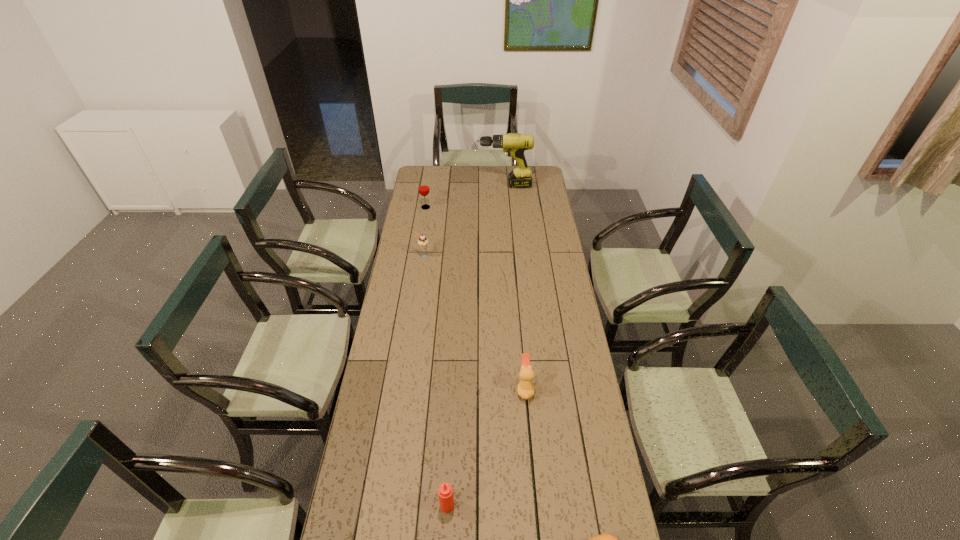
Locate an element on the screen. free space that is in between the glass and the duck is located at coordinates (475, 298).

Locate an element on the screen. vacant region between the drill and the glass is located at coordinates (465, 197).

Identify the location of free space that is in between the Tabasco sauce and the fifth tallest object. (486, 447).

Locate an element on the screen. Image resolution: width=960 pixels, height=540 pixels. empty space that is in between the icecream and the Tabasco sauce is located at coordinates (435, 381).

The height and width of the screenshot is (540, 960). Identify the location of vacant space in between the fifth farthest object and the drill. (476, 346).

Identify which object is the third nearest to the nearest object. Please provide its 2D coordinates. Your answer should be formatted as a tuple, i.e. [(x, y)], where the tuple contains the x and y coordinates of a point satisfying the conditions above.

[(422, 241)]

Select which object appears as the second closest to the second nearest object. Please provide its 2D coordinates. Your answer should be formatted as a tuple, i.e. [(x, y)], where the tuple contains the x and y coordinates of a point satisfying the conditions above.

[(525, 388)]

Identify the location of vacant area in the image that satisfies the following two spatial constraints: 1. on the handle side of the farthest object; 2. on the front side of the icecream. (510, 256).